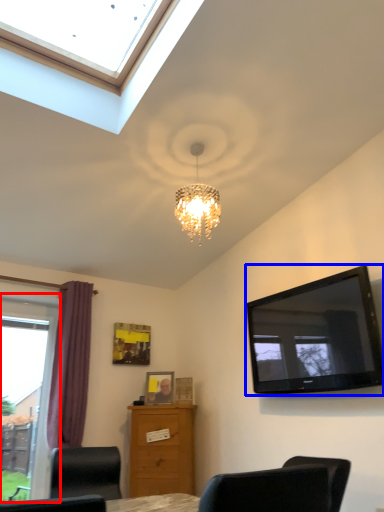
Question: Which point is further to the camera, window (highlighted by a red box) or television (highlighted by a blue box)?

Choices:
 (A) window
 (B) television

Answer: (A)